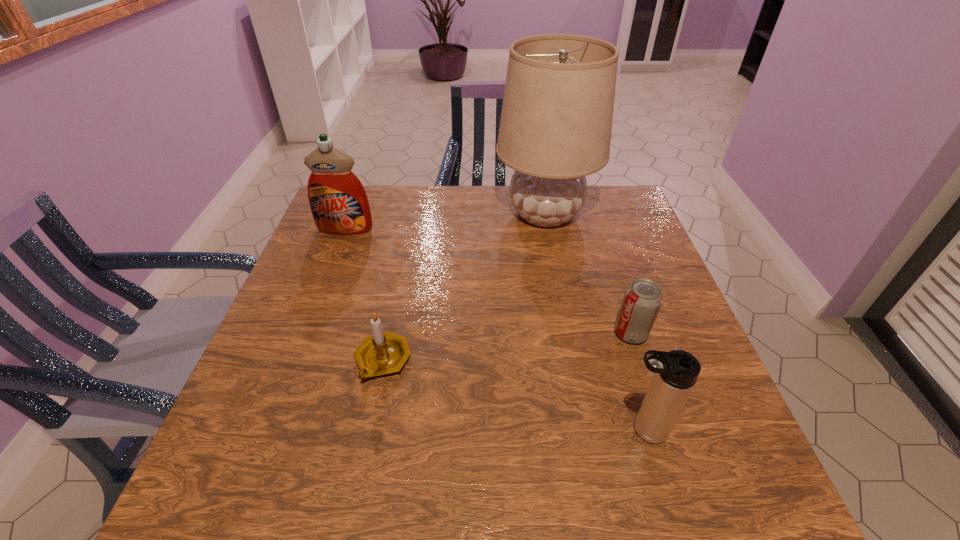
Where is `free point between the second object from left to right and the nearest object`? The width and height of the screenshot is (960, 540). free point between the second object from left to right and the nearest object is located at coordinates (513, 395).

The image size is (960, 540). Find the location of `free space between the nearest object and the fourth shortest object`. free space between the nearest object and the fourth shortest object is located at coordinates (493, 329).

This screenshot has width=960, height=540. What are the coordinates of `free space that is in between the tallest object and the detergent` in the screenshot? It's located at (445, 221).

Locate an element on the screen. The image size is (960, 540). free space between the soda can and the lampshade is located at coordinates (588, 273).

Where is `free area in between the fourth object from right to left and the thermos bottle`? This screenshot has height=540, width=960. free area in between the fourth object from right to left and the thermos bottle is located at coordinates (513, 395).

In order to click on vacant area between the tallest object and the nearest object in this screenshot , I will do point(593,322).

Find the location of a particular element. This screenshot has width=960, height=540. free point between the soda can and the lampshade is located at coordinates (588, 273).

Identify which object is the nearest to the tallest object. Please provide its 2D coordinates. Your answer should be formatted as a tuple, i.e. [(x, y)], where the tuple contains the x and y coordinates of a point satisfying the conditions above.

[(643, 297)]

Locate an element on the screen. This screenshot has height=540, width=960. object that is the third nearest to the leftmost object is located at coordinates (643, 297).

Identify the location of free point that satisfies the following two spatial constraints: 1. on the back side of the fourth object from right to left; 2. on the right side of the soda can. This screenshot has width=960, height=540. (388, 333).